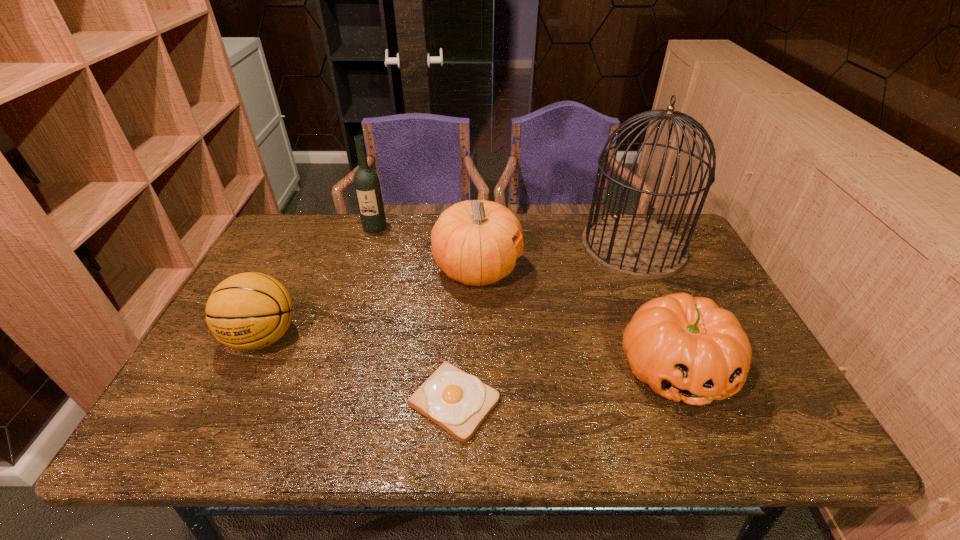
This screenshot has width=960, height=540. What are the coordinates of `free area in between the nearer pumpkin and the left pumpkin` in the screenshot? It's located at (576, 319).

Locate an element on the screen. The height and width of the screenshot is (540, 960). object that stands as the fourth closest to the farther pumpkin is located at coordinates (686, 348).

Find the location of `object that is the second closest to the leftmost object`. object that is the second closest to the leftmost object is located at coordinates (471, 241).